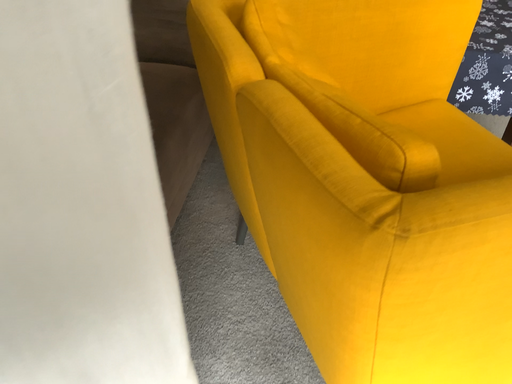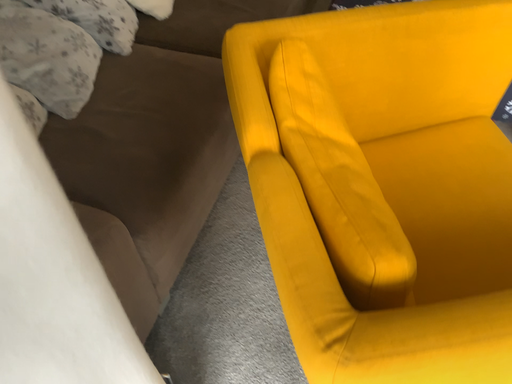
Question: How did the camera likely rotate when shooting the video?

Choices:
 (A) rotated left
 (B) rotated right

Answer: (A)